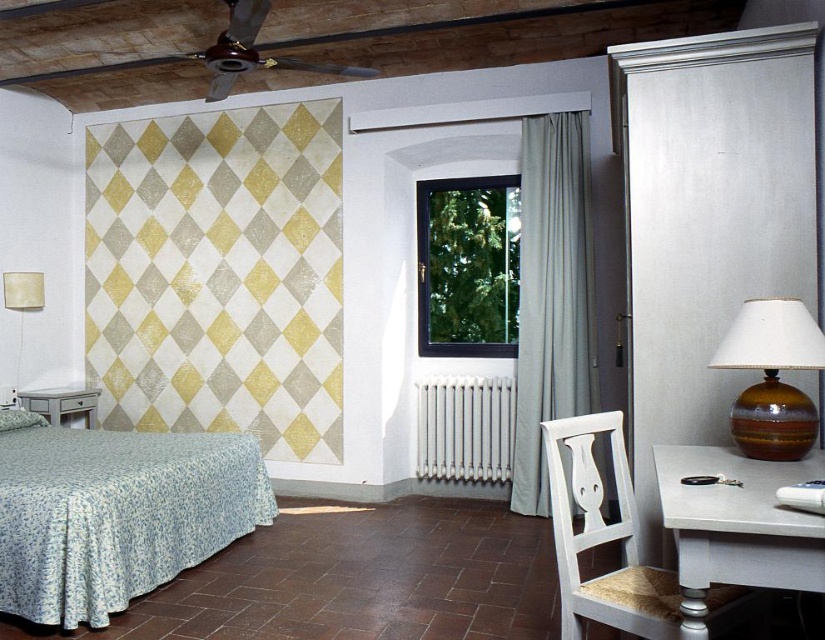
Question: In this image, where is green fabric curtain at center located relative to white glossy nightstand at lower left?

Choices:
 (A) left
 (B) right

Answer: (B)

Question: Which of the following is the closest to the observer?

Choices:
 (A) white glossy nightstand at lower left
 (B) white metallic radiator at lower center
 (C) matte cream lampshade at left

Answer: (B)

Question: Which point is closer to the camera?

Choices:
 (A) (680, 448)
 (B) (429, 442)

Answer: (A)

Question: Which point is closer to the camera?

Choices:
 (A) white wood chair at lower right
 (B) white glossy table at lower right

Answer: (B)

Question: Does white glossy table at lower right have a greater width compared to white glossy nightstand at lower left?

Choices:
 (A) no
 (B) yes

Answer: (B)

Question: Can you confirm if white glossy table at lower right is smaller than brown glossy lamp at right?

Choices:
 (A) yes
 (B) no

Answer: (B)